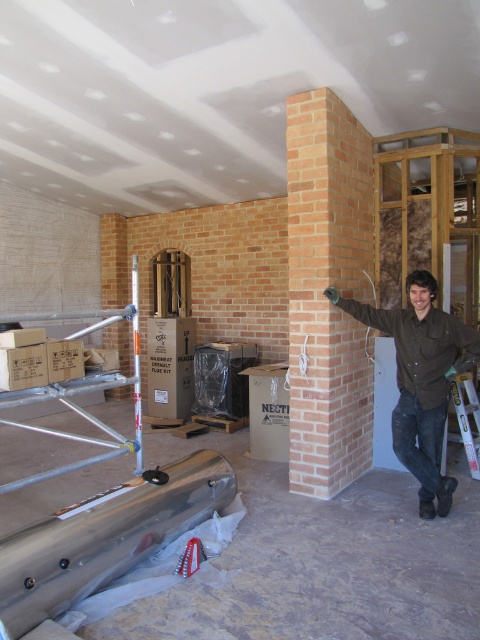
Between light brown brick chimney at center and brown cotton shirt at center, which one appears on the left side from the viewer's perspective?

light brown brick chimney at center

In the scene shown: Measure the distance between light brown brick chimney at center and camera.

light brown brick chimney at center and camera are 11.70 feet apart.

Locate an element on the screen. light brown brick chimney at center is located at coordinates (324, 288).

Is brown cotton shirt at center bigger than metallic silver ladder at right?

Yes.

Which is more to the right, brown cotton shirt at center or metallic silver ladder at right?

metallic silver ladder at right

Is point (339, 300) farther from viewer compared to point (451, 380)?

Yes, point (339, 300) is behind point (451, 380).

Where is `brown cotton shirt at center`? This screenshot has width=480, height=640. brown cotton shirt at center is located at coordinates coord(420,380).

Consider the image. Between light brown brick chimney at center and metallic silver ladder at right, which one appears on the left side from the viewer's perspective?

From the viewer's perspective, light brown brick chimney at center appears more on the left side.

The image size is (480, 640). What are the coordinates of `light brown brick chimney at center` in the screenshot? It's located at (324, 288).

Where is `light brown brick chimney at center`? This screenshot has height=640, width=480. light brown brick chimney at center is located at coordinates click(324, 288).

Where is `light brown brick chimney at center`? The image size is (480, 640). light brown brick chimney at center is located at coordinates (324, 288).